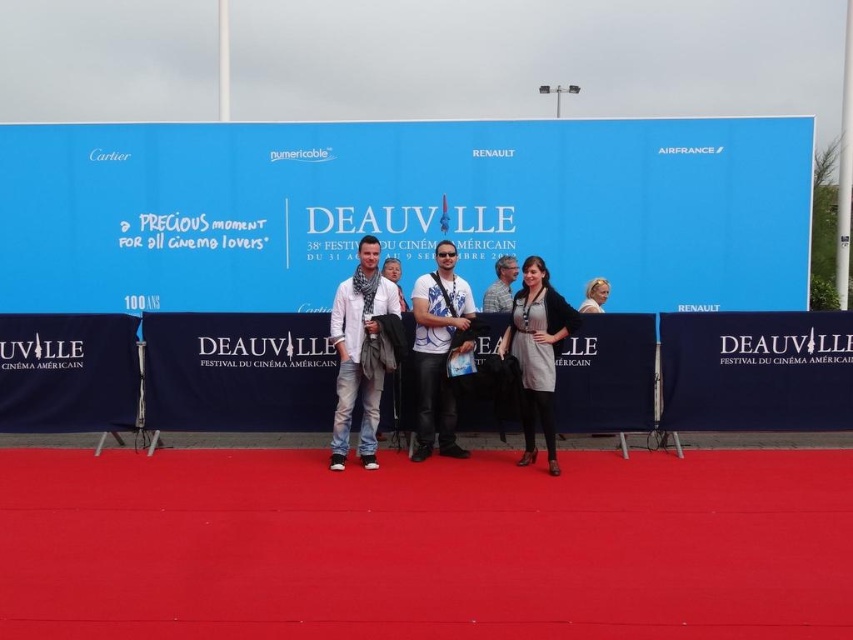
You are a photographer at the DEAUVILLE Festival du Cinema Americain in 2012. You notice two gray items in the center of the scene. Which one is higher up, the matte gray scarf at center or the gray fabric dress at center?

The matte gray scarf at center is above the gray fabric dress at center, so the scarf is higher up.

You are a photographer at the DEAUVILLE Festival event. You need to ensure that all participants are visible in the group photo. Given that the matte white shirt at center and the gray striped shirt at center are both in focus, which one might appear more prominent in the photo?

The matte white shirt at center appears more prominent because it is larger in size than the gray striped shirt at center.